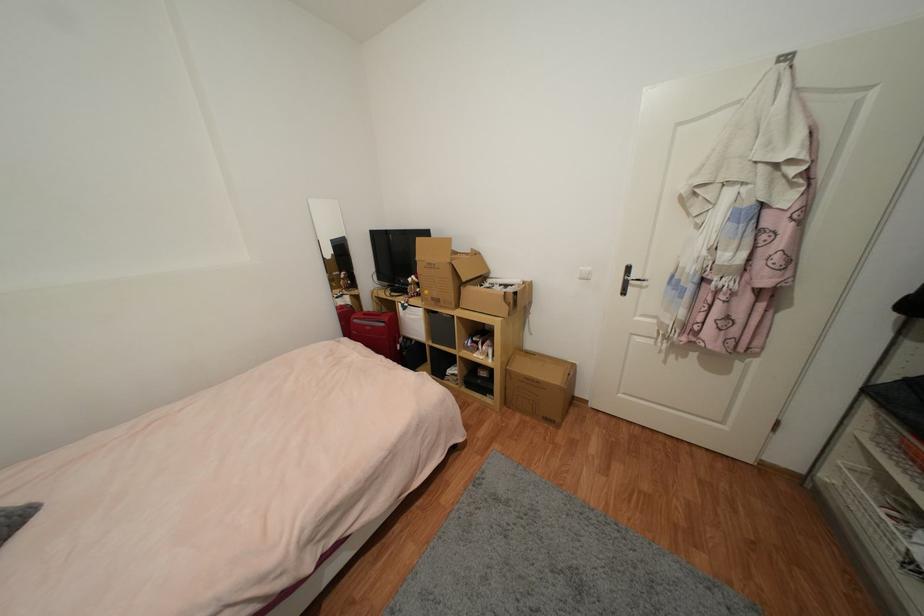
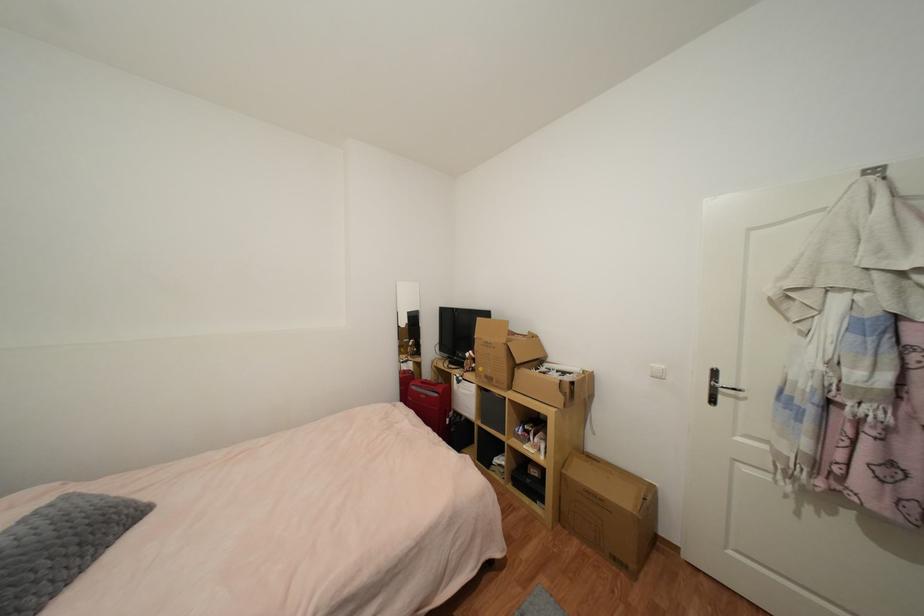
Find the pixel in the second image that matches pixel 386 326 in the first image.

(440, 397)